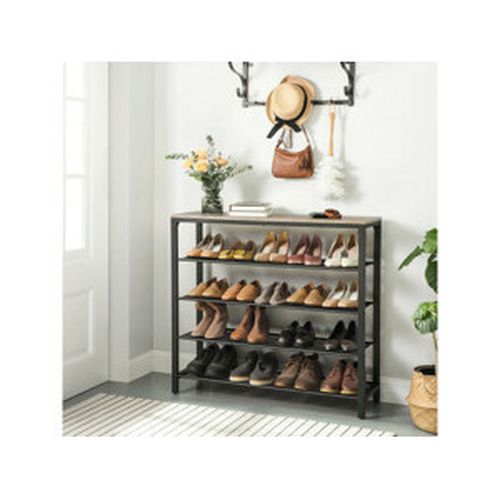
Where is `large plant leaves`? The height and width of the screenshot is (500, 500). large plant leaves is located at coordinates (428, 321), (433, 276), (430, 241), (411, 256).